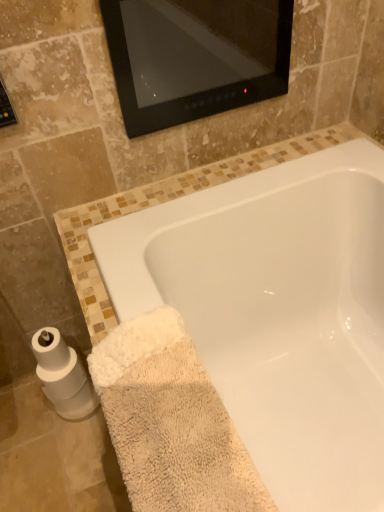
Where is `free point above beige fluffy towel at lower left (from a real-world perspective)`? This screenshot has height=512, width=384. free point above beige fluffy towel at lower left (from a real-world perspective) is located at coordinates (181, 390).